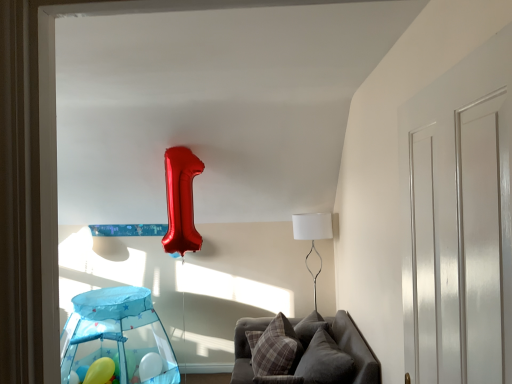
What do you see at coordinates (325, 361) in the screenshot? This screenshot has width=512, height=384. I see `plush gray pillow at lower center, which ranks as the first pillow in right-to-left order` at bounding box center [325, 361].

What do you see at coordinates (312, 236) in the screenshot? This screenshot has width=512, height=384. I see `white fabric lampshade at right` at bounding box center [312, 236].

Image resolution: width=512 pixels, height=384 pixels. Identify the location of white glossy door at right. (457, 236).

What do you see at coordinates (357, 349) in the screenshot?
I see `velvet gray couch at lower center` at bounding box center [357, 349].

The image size is (512, 384). Describe the element at coordinates (118, 337) in the screenshot. I see `transparent plastic play tent at lower left` at that location.

Locate an element on the screen. The image size is (512, 384). plaid fabric pillow at lower center, which is the 2th pillow from right to left is located at coordinates (276, 349).

Image resolution: width=512 pixels, height=384 pixels. Describe the element at coordinates (100, 371) in the screenshot. I see `matte yellow balloon at lower left` at that location.

Locate an element on the screen. plush gray pillow at lower center, which appears as the 2th pillow when viewed from the left is located at coordinates (325, 361).

Between transparent plastic play tent at lower left and velvet gray couch at lower center, which one has smaller size?

transparent plastic play tent at lower left.

Considering the points (88, 330) and (348, 317), which point is behind, point (88, 330) or point (348, 317)?

The point (88, 330) is behind.

Consider the image. Is transparent plastic play tent at lower left turned away from velvet gray couch at lower center?

transparent plastic play tent at lower left does not have its back to velvet gray couch at lower center.

Does transparent plastic play tent at lower left have a greater width compared to velvet gray couch at lower center?

Incorrect, the width of transparent plastic play tent at lower left does not surpass that of velvet gray couch at lower center.

Is white fabric lampshade at right positioned with its back to plaid fabric pillow at lower center, positioned as the 1th pillow in left-to-right order?

Answer: white fabric lampshade at right is not turned away from plaid fabric pillow at lower center, positioned as the 1th pillow in left-to-right order.

Is white fabric lampshade at right far away from plaid fabric pillow at lower center, positioned as the 1th pillow in left-to-right order?

Yes, white fabric lampshade at right is far from plaid fabric pillow at lower center, positioned as the 1th pillow in left-to-right order.

In terms of size, does white fabric lampshade at right appear bigger or smaller than plaid fabric pillow at lower center, which is the 2th pillow from right to left?

white fabric lampshade at right is bigger than plaid fabric pillow at lower center, which is the 2th pillow from right to left.

Based on the photo, from the image's perspective, which one is positioned higher, white fabric lampshade at right or plaid fabric pillow at lower center, which is the 2th pillow from right to left?

white fabric lampshade at right appears higher in the image.

Does matte yellow balloon at lower left turn towards plaid fabric pillow at lower center, which is the 2th pillow from right to left?

No, matte yellow balloon at lower left is not aimed at plaid fabric pillow at lower center, which is the 2th pillow from right to left.

Is matte yellow balloon at lower left next to plaid fabric pillow at lower center, positioned as the 1th pillow in left-to-right order?

No.

Is point (87, 381) farther from camera compared to point (257, 363)?

Yes, it is behind point (257, 363).

Is matte yellow balloon at lower left completely or partially outside of plaid fabric pillow at lower center, positioned as the 1th pillow in left-to-right order?

Yes, matte yellow balloon at lower left is outside of plaid fabric pillow at lower center, positioned as the 1th pillow in left-to-right order.

From their relative heights in the image, would you say velvet gray couch at lower center is taller or shorter than plaid fabric pillow at lower center, which is the 2th pillow from right to left?

velvet gray couch at lower center is taller than plaid fabric pillow at lower center, which is the 2th pillow from right to left.

Looking at this image, could you tell me if velvet gray couch at lower center is turned towards plaid fabric pillow at lower center, which is the 2th pillow from right to left?

Yes.

Based on the photo, is velvet gray couch at lower center smaller than plaid fabric pillow at lower center, which is the 2th pillow from right to left?

No, velvet gray couch at lower center is not smaller than plaid fabric pillow at lower center, which is the 2th pillow from right to left.

Is point (366, 369) more distant than point (265, 345)?

No, it is not.

Is white fabric lampshade at right a part of transparent plastic play tent at lower left?

No, white fabric lampshade at right is not a part of transparent plastic play tent at lower left.

Which is in front, point (133, 315) or point (305, 221)?

The point (133, 315) is in front.

Between transparent plastic play tent at lower left and white fabric lampshade at right, which one appears on the left side from the viewer's perspective?

transparent plastic play tent at lower left is more to the left.

Based on the photo, does white fabric lampshade at right appear on the right side of matte yellow balloon at lower left?

Yes, white fabric lampshade at right is to the right of matte yellow balloon at lower left.

I want to click on balloon in front of the white fabric lampshade at right, so click(x=100, y=371).

From the image's perspective, would you say white fabric lampshade at right is positioned over matte yellow balloon at lower left?

Indeed, from the image's perspective, white fabric lampshade at right is shown above matte yellow balloon at lower left.

What are the coordinates of `furniture on the left of white fabric lampshade at right` in the screenshot? It's located at (357, 349).

Which is more distant, (234,331) or (328,233)?

The point (234,331) is more distant.

Could you tell me if velvet gray couch at lower center is facing white fabric lampshade at right?

No.

Choose the correct answer: Is velvet gray couch at lower center inside white fabric lampshade at right or outside it?

velvet gray couch at lower center is not enclosed by white fabric lampshade at right.

This screenshot has height=384, width=512. What are the coordinates of `glass box to the left of velvet gray couch at lower center` in the screenshot? It's located at (118, 337).

Locate an element on the screen. The width and height of the screenshot is (512, 384). table lamp above the plaid fabric pillow at lower center, positioned as the 1th pillow in left-to-right order (from the image's perspective) is located at coordinates (312, 236).

In the scene shown: Looking at the image, which one is located further to transparent plastic play tent at lower left, matte yellow balloon at lower left or white glossy door at right?

white glossy door at right is positioned further to the anchor transparent plastic play tent at lower left.

From the image, which object appears to be nearer to white glossy door at right, plaid fabric pillow at lower center, positioned as the 1th pillow in left-to-right order, or plush gray pillow at lower center, which ranks as the first pillow in right-to-left order?

The object closer to white glossy door at right is plush gray pillow at lower center, which ranks as the first pillow in right-to-left order.

Considering their positions, is white fabric lampshade at right positioned closer to transparent plastic play tent at lower left than plush gray pillow at lower center, which ranks as the first pillow in right-to-left order?

plush gray pillow at lower center, which ranks as the first pillow in right-to-left order, is positioned closer to the anchor transparent plastic play tent at lower left.

Estimate the real-world distances between objects in this image. Which object is closer to matte yellow balloon at lower left, plaid fabric pillow at lower center, which is the 2th pillow from right to left, or white fabric lampshade at right?

The object closer to matte yellow balloon at lower left is plaid fabric pillow at lower center, which is the 2th pillow from right to left.

Consider the image. Based on their spatial positions, is white fabric lampshade at right or plaid fabric pillow at lower center, which is the 2th pillow from right to left, further from plush gray pillow at lower center, which appears as the 2th pillow when viewed from the left?

The object further to plush gray pillow at lower center, which appears as the 2th pillow when viewed from the left, is white fabric lampshade at right.

Considering their positions, is white glossy door at right positioned further to matte yellow balloon at lower left than velvet gray couch at lower center?

white glossy door at right.

When comparing their distances from plush gray pillow at lower center, which appears as the 2th pillow when viewed from the left, does white glossy door at right or transparent plastic play tent at lower left seem further?

transparent plastic play tent at lower left is positioned further to the anchor plush gray pillow at lower center, which appears as the 2th pillow when viewed from the left.

Looking at the image, which one is located closer to matte yellow balloon at lower left, plaid fabric pillow at lower center, which is the 2th pillow from right to left, or velvet gray couch at lower center?

Among the two, plaid fabric pillow at lower center, which is the 2th pillow from right to left, is located nearer to matte yellow balloon at lower left.

At what (x,y) coordinates should I click in order to perform the action: click on pillow located between matte yellow balloon at lower left and velvet gray couch at lower center in the left-right direction. Please return your answer as a coordinate pair (x, y). The image size is (512, 384). Looking at the image, I should click on (276, 349).

This screenshot has height=384, width=512. Identify the location of pillow between white glossy door at right and plaid fabric pillow at lower center, positioned as the 1th pillow in left-to-right order, from front to back. (325, 361).

You are a GUI agent. You are given a task and a screenshot of the screen. Output one action in this format:
    pyautogui.click(x=<x>, y=<y>)
    Task: Click on the furniture between matte yellow balloon at lower left and white fabric lampshade at right
    The height and width of the screenshot is (384, 512).
    Given the screenshot: What is the action you would take?
    pyautogui.click(x=357, y=349)

Where is `furniture located between white glossy door at right and plaid fabric pillow at lower center, positioned as the 1th pillow in left-to-right order, in the depth direction`? The image size is (512, 384). furniture located between white glossy door at right and plaid fabric pillow at lower center, positioned as the 1th pillow in left-to-right order, in the depth direction is located at coordinates (357, 349).